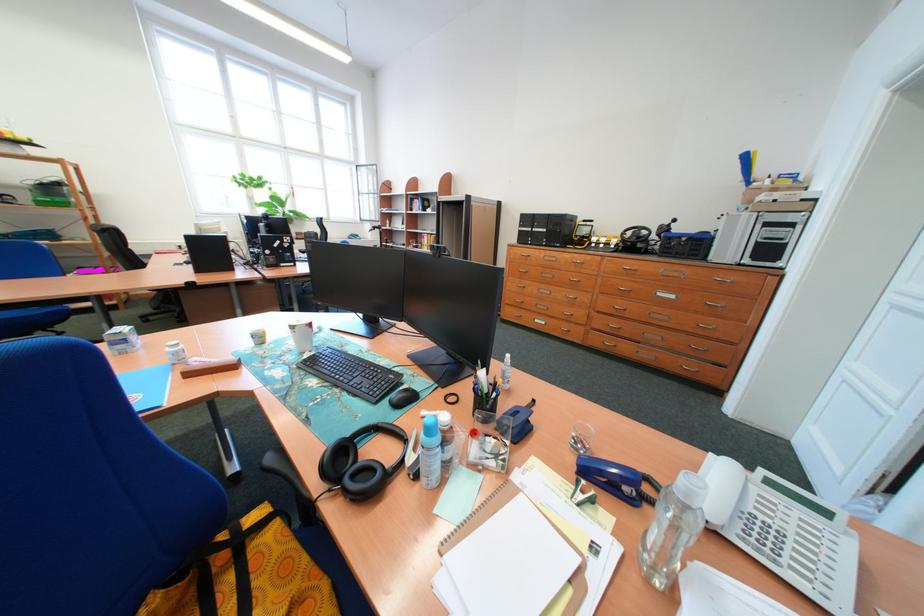
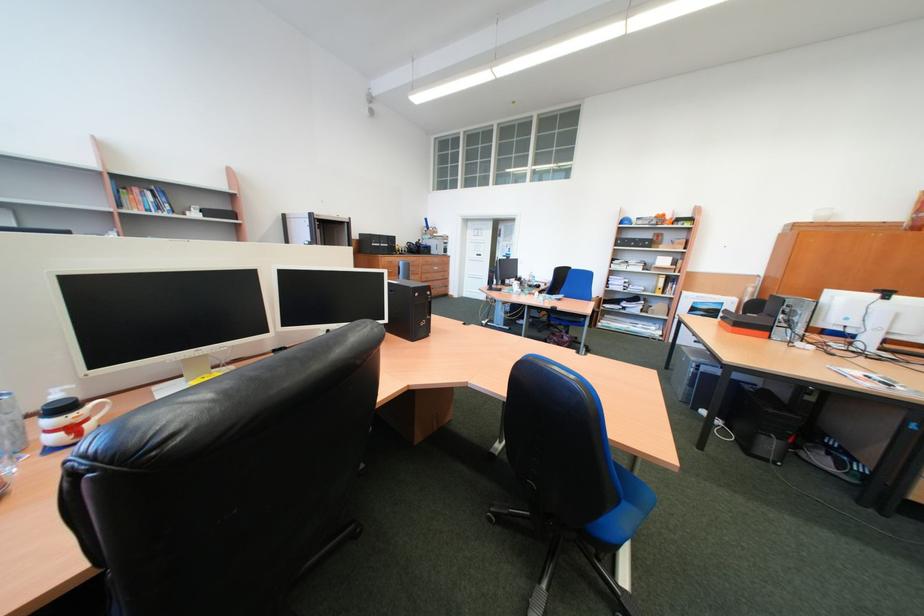
The point at (424, 211) is marked in the first image. Where is the corresponding point in the second image?

(134, 207)